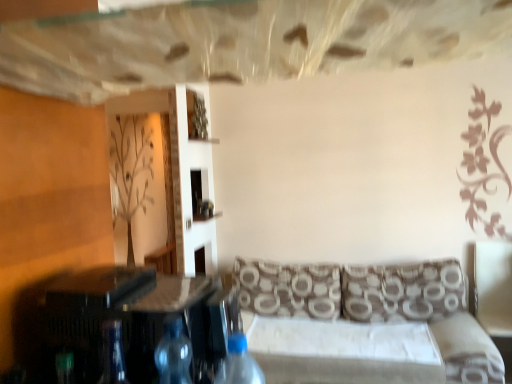
What is the approximate height of blue translucent bottle at lower center, which is the first bottle from right to left?

blue translucent bottle at lower center, which is the first bottle from right to left, is 11.89 inches in height.

Describe the element at coordinates (173, 352) in the screenshot. The image size is (512, 384). I see `transparent plastic bottle at center, which is the 2th bottle from right to left` at that location.

Locate an element on the screen. This screenshot has width=512, height=384. transparent plastic bottle at center, arranged as the 1th bottle when viewed from the left is located at coordinates (173, 352).

The width and height of the screenshot is (512, 384). Describe the element at coordinates (289, 289) in the screenshot. I see `brown printed cushion at center, arranged as the 1th pillow when viewed from the left` at that location.

In order to face brown printed cushion at center, arranged as the 1th pillow when viewed from the left, should I rotate leftwards or rightwards?

It's best to rotate right around 3.966 degrees.

What is the approximate height of brown wood plywood at left?

brown wood plywood at left is 38.04 inches in height.

What do you see at coordinates (47, 204) in the screenshot? This screenshot has width=512, height=384. I see `brown wood plywood at left` at bounding box center [47, 204].

What do you see at coordinates (493, 294) in the screenshot?
I see `white leather swivel chair at right` at bounding box center [493, 294].

Measure the distance between white leather swivel chair at right and camera.

Answer: white leather swivel chair at right and camera are 2.93 meters apart.

Find the location of a particular element. Image resolution: width=512 pixels, height=384 pixels. blue translucent bottle at lower center, which is the first bottle from right to left is located at coordinates (239, 364).

Is point (243, 305) farther from viewer compared to point (219, 380)?

Yes, it is behind point (219, 380).

From the image's perspective, which is above, brown printed cushion at center, arranged as the 1th pillow when viewed from the left, or blue translucent bottle at lower center, which is the first bottle from right to left?

From the image's view, blue translucent bottle at lower center, which is the first bottle from right to left, is above.

Is brown printed cushion at center, arranged as the 1th pillow when viewed from the left, smaller than blue translucent bottle at lower center, which is the first bottle from right to left?

→ No.

Is brown printed cushion at center, the second pillow viewed from the right, situated inside blue translucent bottle at lower center, which is the second bottle in left-to-right order, or outside?

The correct answer is: outside.

Looking at their sizes, would you say brown patterned fabric couch at center is wider or thinner than brown printed cushion at right, placed as the second pillow when sorted from left to right?

brown patterned fabric couch at center is wider than brown printed cushion at right, placed as the second pillow when sorted from left to right.

Which is nearer, (474, 330) or (458, 310)?

Clearly, point (474, 330) is closer to the camera than point (458, 310).

How different are the orientations of brown patterned fabric couch at center and brown printed cushion at right, marked as the 1th pillow in a right-to-left arrangement, in degrees?

There is a 7.08e-05-degree angle between the facing directions of brown patterned fabric couch at center and brown printed cushion at right, marked as the 1th pillow in a right-to-left arrangement.

Visually, is brown patterned fabric couch at center positioned to the left or to the right of brown printed cushion at right, placed as the second pillow when sorted from left to right?

Clearly, brown patterned fabric couch at center is on the left of brown printed cushion at right, placed as the second pillow when sorted from left to right, in the image.

Considering the sizes of transparent glass table at center and brown printed cushion at right, placed as the second pillow when sorted from left to right, in the image, is transparent glass table at center wider or thinner than brown printed cushion at right, placed as the second pillow when sorted from left to right,?

Clearly, transparent glass table at center has more width compared to brown printed cushion at right, placed as the second pillow when sorted from left to right.

From a real-world perspective, between transparent glass table at center and brown printed cushion at right, marked as the 1th pillow in a right-to-left arrangement, who is vertically lower?

brown printed cushion at right, marked as the 1th pillow in a right-to-left arrangement, from a real-world perspective.

From the image's perspective, is transparent glass table at center under brown printed cushion at right, placed as the second pillow when sorted from left to right?

Actually, transparent glass table at center appears above brown printed cushion at right, placed as the second pillow when sorted from left to right, in the image.

Is point (123, 299) closer or farther from the camera than point (348, 310)?

Point (123, 299) is closer to the camera than point (348, 310).

Considering the positions of points (258, 287) and (509, 313), is point (258, 287) closer to camera compared to point (509, 313)?

That is False.

Is brown printed cushion at center, the second pillow viewed from the right, far away from white leather swivel chair at right?

Indeed, brown printed cushion at center, the second pillow viewed from the right, is not near white leather swivel chair at right.

From a real-world perspective, who is located higher, brown printed cushion at center, the second pillow viewed from the right, or white leather swivel chair at right?

brown printed cushion at center, the second pillow viewed from the right.

Considering the sizes of objects brown printed cushion at center, arranged as the 1th pillow when viewed from the left, and white leather swivel chair at right in the image provided, who is smaller, brown printed cushion at center, arranged as the 1th pillow when viewed from the left, or white leather swivel chair at right?

With smaller size is brown printed cushion at center, arranged as the 1th pillow when viewed from the left.

Would you say transparent glass table at center is a long distance from brown wood plywood at left?

They are positioned close to each other.

From the image's perspective, which is above, transparent glass table at center or brown wood plywood at left?

brown wood plywood at left appears higher in the image.

Measure the distance between transparent glass table at center and brown wood plywood at left.

7.77 inches.

Do you think transparent glass table at center is within brown wood plywood at left, or outside of it?

transparent glass table at center lies outside brown wood plywood at left.

Can you confirm if transparent plastic bottle at center, arranged as the 1th bottle when viewed from the left, is positioned to the right of blue translucent bottle at lower center, which is the second bottle in left-to-right order?

In fact, transparent plastic bottle at center, arranged as the 1th bottle when viewed from the left, is to the left of blue translucent bottle at lower center, which is the second bottle in left-to-right order.

Looking at the image, does transparent plastic bottle at center, which is the 2th bottle from right to left, seem bigger or smaller compared to blue translucent bottle at lower center, which is the first bottle from right to left?

Clearly, transparent plastic bottle at center, which is the 2th bottle from right to left, is smaller in size than blue translucent bottle at lower center, which is the first bottle from right to left.

Which of these two, transparent plastic bottle at center, which is the 2th bottle from right to left, or blue translucent bottle at lower center, which is the second bottle in left-to-right order, stands shorter?

With less height is blue translucent bottle at lower center, which is the second bottle in left-to-right order.

How far apart are transparent plastic bottle at center, arranged as the 1th bottle when viewed from the left, and blue translucent bottle at lower center, which is the second bottle in left-to-right order?

transparent plastic bottle at center, arranged as the 1th bottle when viewed from the left, and blue translucent bottle at lower center, which is the second bottle in left-to-right order, are 3.75 inches apart.

From the picture: Considering the relative sizes of brown patterned fabric couch at center and brown wood plywood at left in the image provided, is brown patterned fabric couch at center taller than brown wood plywood at left?

No, brown patterned fabric couch at center is not taller than brown wood plywood at left.

Is brown patterned fabric couch at center located outside brown wood plywood at left?

Absolutely, brown patterned fabric couch at center is external to brown wood plywood at left.

Considering the sizes of objects brown patterned fabric couch at center and brown wood plywood at left in the image provided, who is thinner, brown patterned fabric couch at center or brown wood plywood at left?

brown wood plywood at left.

Does brown patterned fabric couch at center lie in front of brown wood plywood at left?

No, the depth of brown patterned fabric couch at center is greater than that of brown wood plywood at left.

The width and height of the screenshot is (512, 384). I want to click on pillow that is the 1st object to the right of the blue translucent bottle at lower center, which is the second bottle in left-to-right order, starting at the anchor, so (289, 289).

This screenshot has width=512, height=384. I want to click on studio couch below the brown printed cushion at right, placed as the second pillow when sorted from left to right (from a real-world perspective), so click(x=367, y=315).

Considering their positions, is brown printed cushion at center, the second pillow viewed from the right, positioned further to transparent plastic bottle at center, which is the 2th bottle from right to left, than brown wood plywood at left?

Based on the image, brown printed cushion at center, the second pillow viewed from the right, appears to be further to transparent plastic bottle at center, which is the 2th bottle from right to left.

Estimate the real-world distances between objects in this image. Which object is closer to blue translucent bottle at lower center, which is the second bottle in left-to-right order, transparent glass table at center or brown printed cushion at right, marked as the 1th pillow in a right-to-left arrangement?

transparent glass table at center.

Based on their spatial positions, is brown printed cushion at center, arranged as the 1th pillow when viewed from the left, or transparent plastic bottle at center, which is the 2th bottle from right to left, further from white leather swivel chair at right?

The object further to white leather swivel chair at right is transparent plastic bottle at center, which is the 2th bottle from right to left.

When comparing their distances from brown wood plywood at left, does transparent glass table at center or brown patterned fabric couch at center seem further?

brown patterned fabric couch at center is further to brown wood plywood at left.

Based on their spatial positions, is brown printed cushion at right, marked as the 1th pillow in a right-to-left arrangement, or blue translucent bottle at lower center, which is the second bottle in left-to-right order, further from white leather swivel chair at right?

blue translucent bottle at lower center, which is the second bottle in left-to-right order, is further to white leather swivel chair at right.

Based on their spatial positions, is brown printed cushion at right, marked as the 1th pillow in a right-to-left arrangement, or transparent glass table at center closer to brown printed cushion at center, the second pillow viewed from the right?

The object closer to brown printed cushion at center, the second pillow viewed from the right, is brown printed cushion at right, marked as the 1th pillow in a right-to-left arrangement.

From the image, which object appears to be nearer to transparent glass table at center, white leather swivel chair at right or brown wood plywood at left?

The object closer to transparent glass table at center is brown wood plywood at left.

Estimate the real-world distances between objects in this image. Which object is further from brown wood plywood at left, blue translucent bottle at lower center, which is the first bottle from right to left, or transparent glass table at center?

blue translucent bottle at lower center, which is the first bottle from right to left, is positioned further to the anchor brown wood plywood at left.

Locate an element on the screen. plywood between blue translucent bottle at lower center, which is the first bottle from right to left, and brown patterned fabric couch at center in the front-back direction is located at coordinates (47, 204).

You are a GUI agent. You are given a task and a screenshot of the screen. Output one action in this format:
    pyautogui.click(x=<x>, y=<y>)
    Task: Click on the studio couch located between transparent glass table at center and white leather swivel chair at right in the depth direction
    This screenshot has height=384, width=512.
    Given the screenshot: What is the action you would take?
    pyautogui.click(x=367, y=315)

I want to click on pillow between brown patterned fabric couch at center and white leather swivel chair at right from left to right, so click(403, 291).

This screenshot has height=384, width=512. I want to click on table between brown wood plywood at left and white leather swivel chair at right from left to right, so pyautogui.click(x=132, y=318).